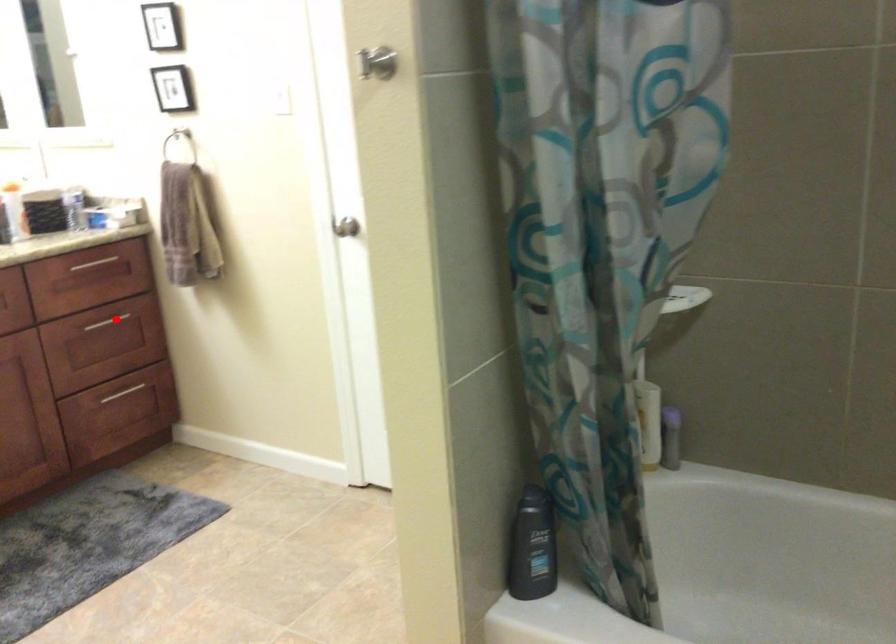
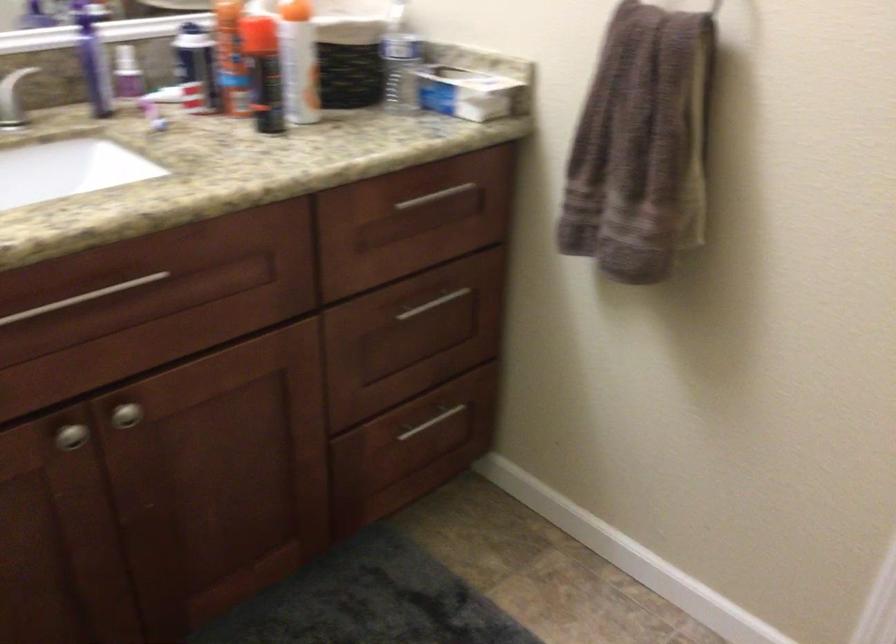
In the second image, find the point that corresponds to the highlighted location in the first image.

(434, 304)